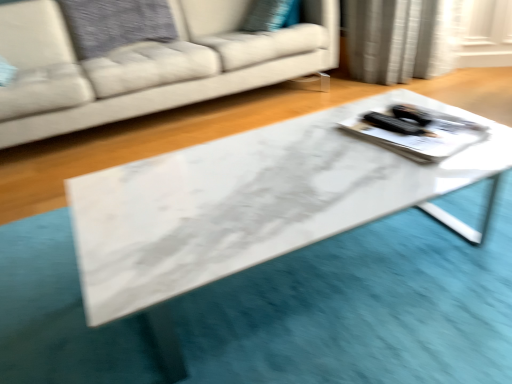
Question: Can you confirm if white glossy tray at center is smaller than white fabric couch at center?

Choices:
 (A) yes
 (B) no

Answer: (A)

Question: Considering the relative sizes of white glossy tray at center and white fabric couch at center in the image provided, is white glossy tray at center taller than white fabric couch at center?

Choices:
 (A) yes
 (B) no

Answer: (B)

Question: Is white glossy tray at center looking in the opposite direction of white fabric couch at center?

Choices:
 (A) yes
 (B) no

Answer: (B)

Question: Is the surface of white glossy tray at center in direct contact with white fabric couch at center?

Choices:
 (A) yes
 (B) no

Answer: (B)

Question: Would you say white glossy tray at center contains white fabric couch at center?

Choices:
 (A) no
 (B) yes

Answer: (A)

Question: Is point (311, 62) positioned closer to the camera than point (411, 135)?

Choices:
 (A) closer
 (B) farther

Answer: (B)

Question: From their relative heights in the image, would you say white fabric couch at center is taller or shorter than white glossy tray at center?

Choices:
 (A) tall
 (B) short

Answer: (A)

Question: Is white fabric couch at center to the left or to the right of white glossy tray at center in the image?

Choices:
 (A) right
 (B) left

Answer: (B)

Question: From a real-world perspective, is white fabric couch at center positioned above or below white glossy tray at center?

Choices:
 (A) below
 (B) above

Answer: (B)

Question: From the image's perspective, is white marble table at center located above or below white glossy tray at center?

Choices:
 (A) below
 (B) above

Answer: (A)

Question: Is white marble table at center situated inside white glossy tray at center or outside?

Choices:
 (A) inside
 (B) outside

Answer: (B)

Question: From their relative heights in the image, would you say white marble table at center is taller or shorter than white glossy tray at center?

Choices:
 (A) tall
 (B) short

Answer: (A)

Question: From a real-world perspective, is white marble table at center above or below white glossy tray at center?

Choices:
 (A) below
 (B) above

Answer: (A)

Question: From a real-world perspective, is white marble table at center physically located above or below white fabric couch at center?

Choices:
 (A) above
 (B) below

Answer: (B)

Question: Does point (195, 266) appear closer or farther from the camera than point (187, 44)?

Choices:
 (A) closer
 (B) farther

Answer: (A)